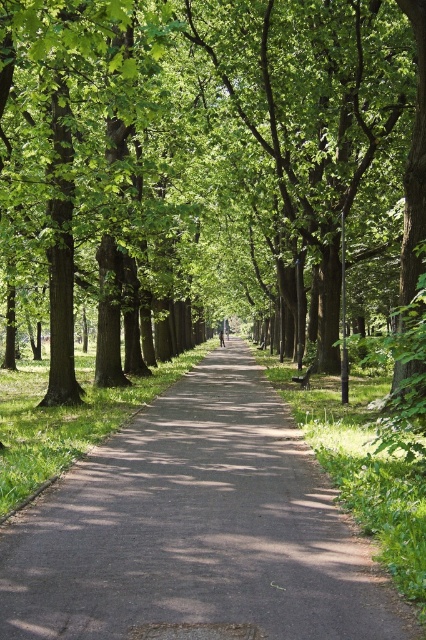
You are standing at the point marked by the coordinates point (207, 172) in the park. Looking around, you see a green leafy tree at center. Which direction should you walk to reach the paved pathway that stretches into the distance?

The point (207, 172) marks the green leafy tree at center. Since the pathway stretches into the distance from the tree, you should walk in the direction away from the tree towards the pathway.